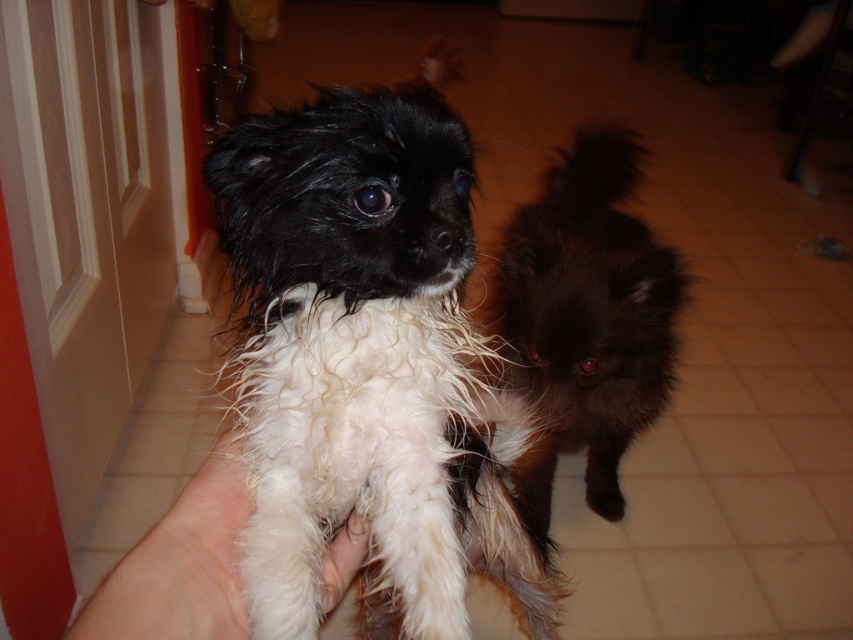
You are a dog trainer who needs to separate two dogs in an indoor area. The dogs are the white fluffy dog at center and the shiny black fur at center. Given that the minimum safe distance for separation is 24 inches, can you safely place them apart using the existing spacing?

The distance between the white fluffy dog at center and the shiny black fur at center is 23.51 inches, which is less than the required 24 inches. Therefore, the existing spacing is insufficient for safe separation, and you would need to adjust their positions to meet the minimum distance requirement.

In the scene shown: You are a photographer trying to capture both the white fluffy dog at center and the white soft hand at center in a single shot. Since you want both subjects to be in focus, which one should you adjust your camera focus on first?

You should focus on the white fluffy dog at center first because it is closer to the viewer than the white soft hand at center, ensuring it stays sharp while adjusting for the other subject.